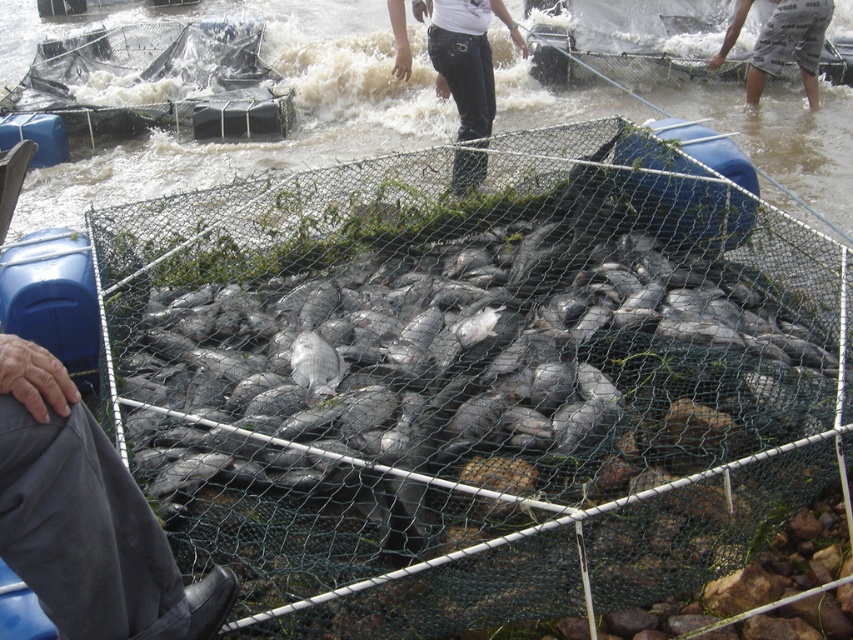
Which is below, black denim pants at upper center or gray cotton shorts at upper right?

black denim pants at upper center is below.

Measure the distance between point (442,68) and camera.

They are 19.76 feet apart.

The width and height of the screenshot is (853, 640). I want to click on black denim pants at upper center, so click(466, 58).

How distant is silvery metallic fish at center from gray fabric pants at lower left?

silvery metallic fish at center and gray fabric pants at lower left are 1.58 meters apart.

Which is behind, point (688, 211) or point (140, 604)?

Point (688, 211)

This screenshot has height=640, width=853. I want to click on silvery metallic fish at center, so click(480, 356).

Is gray fabric pants at lower left thinner than black denim pants at upper center?

Yes, gray fabric pants at lower left is thinner than black denim pants at upper center.

Can you confirm if gray fabric pants at lower left is positioned to the right of black denim pants at upper center?

In fact, gray fabric pants at lower left is to the left of black denim pants at upper center.

Where is `gray fabric pants at lower left`? The width and height of the screenshot is (853, 640). gray fabric pants at lower left is located at coordinates (86, 516).